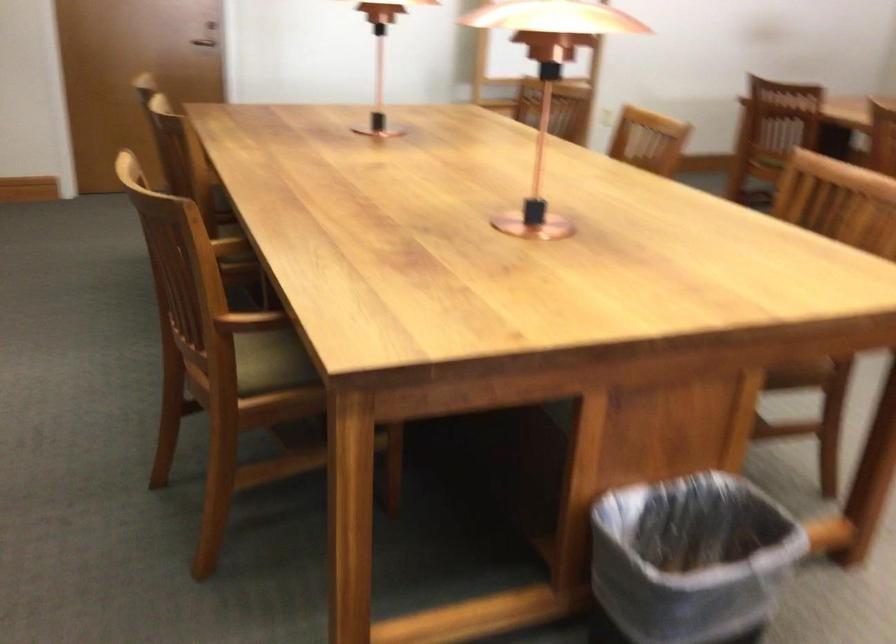
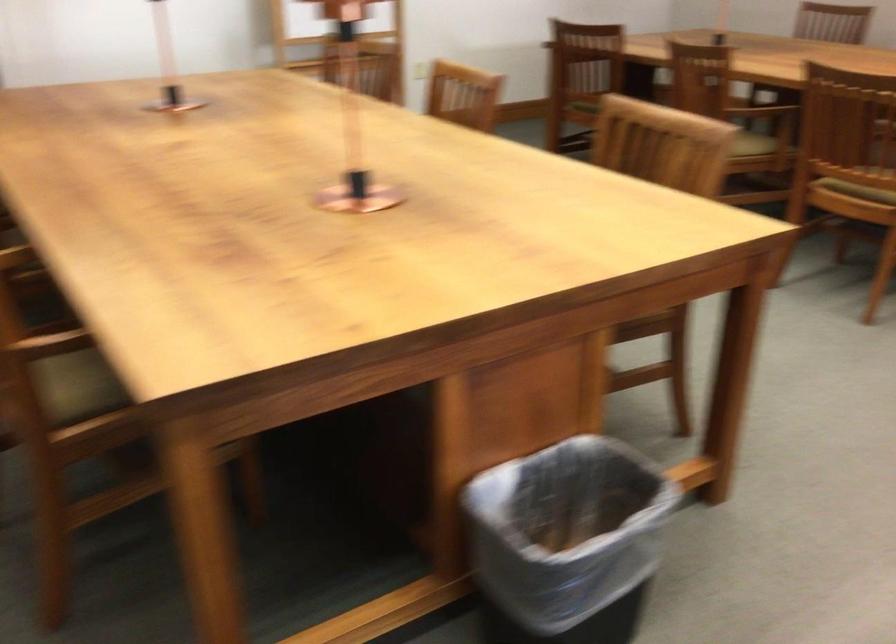
Locate, in the second image, the point that corresponds to (x=254, y=365) in the first image.

(76, 386)